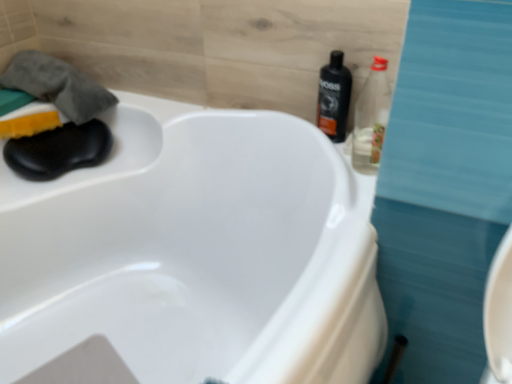
Question: Considering the relative sizes of black plastic bottle at upper right, placed as the 2th bottle when sorted from front to back, and clear plastic bottle at upper right, placed as the second bottle when sorted from back to front, in the image provided, is black plastic bottle at upper right, placed as the 2th bottle when sorted from front to back, smaller than clear plastic bottle at upper right, placed as the second bottle when sorted from back to front,?

Choices:
 (A) yes
 (B) no

Answer: (A)

Question: Can you confirm if black plastic bottle at upper right, the 1th bottle from the back, is thinner than clear plastic bottle at upper right, positioned as the 1th bottle in front-to-back order?

Choices:
 (A) yes
 (B) no

Answer: (B)

Question: Is black plastic bottle at upper right, the 1th bottle from the back, looking in the opposite direction of clear plastic bottle at upper right, placed as the second bottle when sorted from back to front?

Choices:
 (A) no
 (B) yes

Answer: (A)

Question: Would you say clear plastic bottle at upper right, positioned as the 1th bottle in front-to-back order, is part of black plastic bottle at upper right, the 1th bottle from the back,'s contents?

Choices:
 (A) yes
 (B) no

Answer: (B)

Question: Can you confirm if black plastic bottle at upper right, placed as the 2th bottle when sorted from front to back, is shorter than clear plastic bottle at upper right, placed as the second bottle when sorted from back to front?

Choices:
 (A) no
 (B) yes

Answer: (A)

Question: Considering the relative sizes of black plastic bottle at upper right, placed as the 2th bottle when sorted from front to back, and clear plastic bottle at upper right, positioned as the 1th bottle in front-to-back order, in the image provided, is black plastic bottle at upper right, placed as the 2th bottle when sorted from front to back, wider than clear plastic bottle at upper right, positioned as the 1th bottle in front-to-back order,?

Choices:
 (A) yes
 (B) no

Answer: (B)

Question: Considering the relative sizes of gray cotton towel at upper left and clear plastic bottle at upper right, positioned as the 1th bottle in front-to-back order, in the image provided, is gray cotton towel at upper left smaller than clear plastic bottle at upper right, positioned as the 1th bottle in front-to-back order,?

Choices:
 (A) yes
 (B) no

Answer: (B)

Question: From a real-world perspective, is gray cotton towel at upper left positioned over clear plastic bottle at upper right, positioned as the 1th bottle in front-to-back order, based on gravity?

Choices:
 (A) no
 (B) yes

Answer: (A)

Question: Are gray cotton towel at upper left and clear plastic bottle at upper right, positioned as the 1th bottle in front-to-back order, located far from each other?

Choices:
 (A) no
 (B) yes

Answer: (A)

Question: Is gray cotton towel at upper left positioned behind clear plastic bottle at upper right, positioned as the 1th bottle in front-to-back order?

Choices:
 (A) yes
 (B) no

Answer: (A)

Question: Would you say gray cotton towel at upper left contains clear plastic bottle at upper right, placed as the second bottle when sorted from back to front?

Choices:
 (A) no
 (B) yes

Answer: (A)

Question: From the image's perspective, does gray cotton towel at upper left appear lower than clear plastic bottle at upper right, placed as the second bottle when sorted from back to front?

Choices:
 (A) no
 (B) yes

Answer: (A)

Question: Are black plastic bottle at upper right, placed as the 2th bottle when sorted from front to back, and yellow sponge at left beside each other?

Choices:
 (A) no
 (B) yes

Answer: (A)